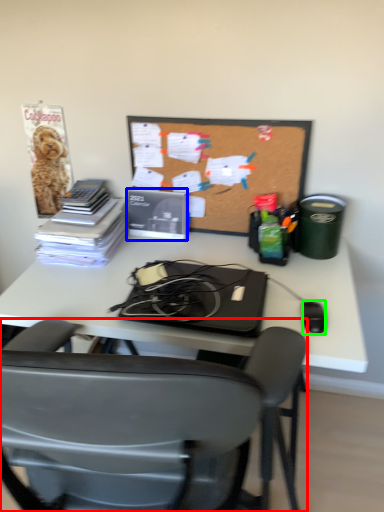
Question: Considering the real-world distances, which object is farthest from chair (highlighted by a red box)? paperback book (highlighted by a blue box) or mouse (highlighted by a green box)?

Choices:
 (A) paperback book
 (B) mouse

Answer: (A)